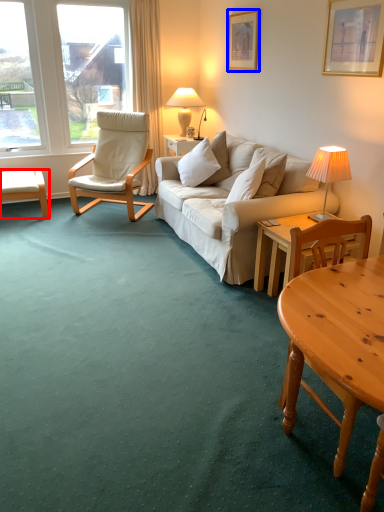
Question: Which of the following is the farthest to the observer, desk (highlighted by a red box) or picture frame (highlighted by a blue box)?

Choices:
 (A) desk
 (B) picture frame

Answer: (A)